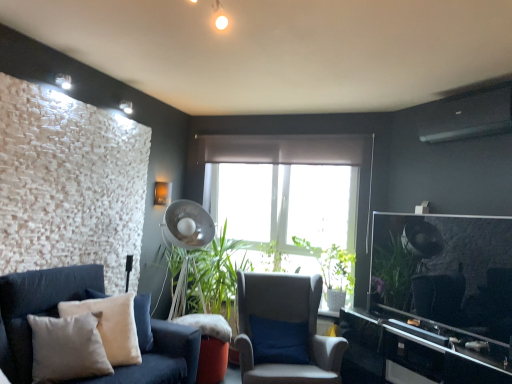
Locate an element on the screen. black glossy entertainment center at right is located at coordinates (417, 351).

What do you see at coordinates (284, 331) in the screenshot? Image resolution: width=512 pixels, height=384 pixels. I see `light gray fabric chair at center` at bounding box center [284, 331].

In the scene shown: What is the approximate width of beige velvet pillow at lower left?

It is 39.86 centimeters.

Find the location of a particular element. white sheer curtain at center is located at coordinates (284, 149).

Describe the element at coordinates (187, 225) in the screenshot. I see `metallic silver mechanical fan at center` at that location.

In order to click on soft cotton couch at lower left in this screenshot , I will do `click(37, 308)`.

From the image's perspective, is metallic silver mechanical fan at center above white sheer curtain at center?

No, from the image's perspective, metallic silver mechanical fan at center is not over white sheer curtain at center.

Which object is positioned more to the right, metallic silver mechanical fan at center or white sheer curtain at center?

From the viewer's perspective, white sheer curtain at center appears more on the right side.

Is point (191, 239) farther from camera compared to point (220, 161)?

No.

Considering their positions, is metallic silver mechanical fan at center located in front of or behind white sheer curtain at center?

metallic silver mechanical fan at center is positioned closer to the viewer than white sheer curtain at center.

Is soft cotton couch at lower left positioned with its back to black glossy entertainment center at right?

soft cotton couch at lower left does not have its back to black glossy entertainment center at right.

Is soft cotton couch at lower left inside or outside of black glossy entertainment center at right?

soft cotton couch at lower left is spatially situated outside black glossy entertainment center at right.

Is soft cotton couch at lower left with black glossy entertainment center at right?

No, soft cotton couch at lower left is not in contact with black glossy entertainment center at right.

From a real-world perspective, is soft cotton couch at lower left above or below black glossy entertainment center at right?

From a real-world perspective, soft cotton couch at lower left is physically above black glossy entertainment center at right.

Does point (362, 142) come farther from viewer compared to point (42, 328)?

Yes, it is.

Which of these two, white sheer curtain at center or beige velvet pillow at lower left, is smaller?

With smaller size is white sheer curtain at center.

Between white sheer curtain at center and beige velvet pillow at lower left, which one has larger width?

With larger width is beige velvet pillow at lower left.

Can you confirm if white sheer curtain at center is taller than beige velvet pillow at lower left?

No, white sheer curtain at center is not taller than beige velvet pillow at lower left.

Does point (18, 370) come farther from viewer compared to point (177, 309)?

No, (18, 370) is closer to viewer.

Considering the sizes of soft cotton couch at lower left and metallic silver mechanical fan at center in the image, is soft cotton couch at lower left bigger or smaller than metallic silver mechanical fan at center?

In the image, soft cotton couch at lower left appears to be smaller than metallic silver mechanical fan at center.

In terms of width, does soft cotton couch at lower left look wider or thinner when compared to metallic silver mechanical fan at center?

Clearly, soft cotton couch at lower left has less width compared to metallic silver mechanical fan at center.

Could you tell me if soft cotton couch at lower left is facing metallic silver mechanical fan at center?

No, soft cotton couch at lower left is not turned towards metallic silver mechanical fan at center.

At what (x,y) coordinates should I click in order to perform the action: click on mechanical fan on the left of black glossy entertainment center at right. Please return your answer as a coordinate pair (x, y). The width and height of the screenshot is (512, 384). Looking at the image, I should click on (187, 225).

Considering the relative positions of metallic silver mechanical fan at center and black glossy entertainment center at right in the image provided, is metallic silver mechanical fan at center to the left of black glossy entertainment center at right from the viewer's perspective?

Indeed, metallic silver mechanical fan at center is positioned on the left side of black glossy entertainment center at right.

From a real-world perspective, which is physically below, metallic silver mechanical fan at center or black glossy entertainment center at right?

From a 3D spatial view, black glossy entertainment center at right is below.

Can you see metallic silver mechanical fan at center touching black glossy entertainment center at right?

metallic silver mechanical fan at center is not next to black glossy entertainment center at right, and they're not touching.

From a real-world perspective, which is physically above, light gray fabric chair at center or green matte plant at center?

green matte plant at center, from a real-world perspective.

Where is `chair below the green matte plant at center (from a real-world perspective)`? chair below the green matte plant at center (from a real-world perspective) is located at coordinates (284, 331).

Does light gray fabric chair at center appear on the right side of green matte plant at center?

In fact, light gray fabric chair at center is to the left of green matte plant at center.

How many degrees apart are the facing directions of white sheer curtain at center and soft cotton couch at lower left?

white sheer curtain at center and soft cotton couch at lower left are facing 65.6 degrees away from each other.

Between point (297, 142) and point (130, 374), which one is positioned behind?

The point (297, 142) is farther from the camera.

Which is correct: white sheer curtain at center is inside soft cotton couch at lower left, or outside of it?

white sheer curtain at center is outside soft cotton couch at lower left.

Considering the relative positions of white sheer curtain at center and soft cotton couch at lower left in the image provided, is white sheer curtain at center to the right of soft cotton couch at lower left from the viewer's perspective?

Yes, white sheer curtain at center is to the right of soft cotton couch at lower left.

Where is `mechanical fan on the left of white sheer curtain at center`? mechanical fan on the left of white sheer curtain at center is located at coordinates (187, 225).

At what (x,y) coordinates should I click in order to perform the action: click on studio couch above the black glossy entertainment center at right (from the image's perspective). Please return your answer as a coordinate pair (x, y). Looking at the image, I should click on (37, 308).

Looking at the image, which one is located closer to soft cotton couch at lower left, green matte plant at center or beige velvet pillow at lower left?

beige velvet pillow at lower left is closer to soft cotton couch at lower left.

Considering their positions, is soft cotton couch at lower left positioned further to beige velvet pillow at lower left than black glossy entertainment center at right?

black glossy entertainment center at right is positioned further to the anchor beige velvet pillow at lower left.

From the image, which object appears to be nearer to light gray fabric chair at center, white sheer curtain at center or soft cotton couch at lower left?

soft cotton couch at lower left lies closer to light gray fabric chair at center than the other object.

Considering their positions, is soft cotton couch at lower left positioned further to beige velvet pillow at lower left than metallic silver mechanical fan at center?

The object further to beige velvet pillow at lower left is metallic silver mechanical fan at center.

Which object lies further to the anchor point light gray fabric chair at center, beige velvet pillow at lower left or white sheer curtain at center?

white sheer curtain at center is positioned further to the anchor light gray fabric chair at center.

Looking at the image, which one is located further to metallic silver mechanical fan at center, soft cotton couch at lower left or beige velvet pillow at lower left?

beige velvet pillow at lower left is positioned further to the anchor metallic silver mechanical fan at center.

Based on their spatial positions, is light gray fabric chair at center or black glossy entertainment center at right further from white sheer curtain at center?

black glossy entertainment center at right is positioned further to the anchor white sheer curtain at center.

Looking at the image, which one is located closer to white sheer curtain at center, beige velvet pillow at lower left or black glossy entertainment center at right?

black glossy entertainment center at right is closer to white sheer curtain at center.

Locate an element on the screen. plant between metallic silver mechanical fan at center and black glossy entertainment center at right in the horizontal direction is located at coordinates (332, 264).

What are the coordinates of `plant between black glossy entertainment center at right and white sheer curtain at center along the z-axis` in the screenshot? It's located at (332, 264).

Where is `chair located between soft cotton couch at lower left and black glossy entertainment center at right in the left-right direction`? The width and height of the screenshot is (512, 384). chair located between soft cotton couch at lower left and black glossy entertainment center at right in the left-right direction is located at coordinates (284, 331).

At what (x,y) coordinates should I click in order to perform the action: click on chair situated between beige velvet pillow at lower left and green matte plant at center from left to right. Please return your answer as a coordinate pair (x, y). Looking at the image, I should click on (284, 331).